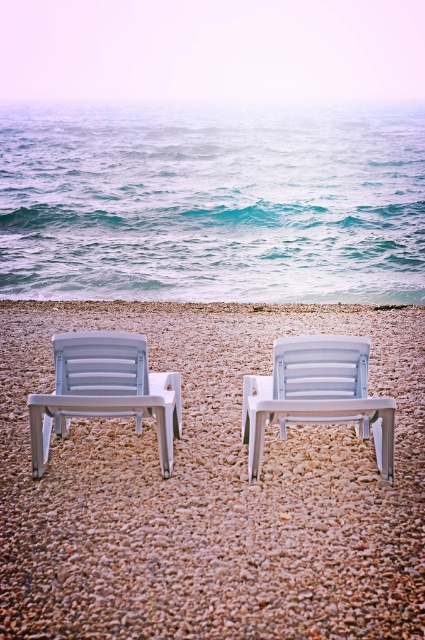
Question: Is the position of white pebbles at center more distant than that of white plastic beach chair at left?

Choices:
 (A) no
 (B) yes

Answer: (A)

Question: Which point is farther from the camera taking this photo?

Choices:
 (A) (229, 563)
 (B) (147, 362)
 (C) (365, 291)
 (D) (356, 428)

Answer: (C)

Question: Estimate the real-world distances between objects in this image. Which object is closer to the blue water at upper center?

Choices:
 (A) white plastic beach chair at left
 (B) white plastic beach chair at center
 (C) white pebbles at center

Answer: (B)

Question: Among these objects, which one is farthest from the camera?

Choices:
 (A) white pebbles at center
 (B) white plastic beach chair at left
 (C) blue water at upper center
 (D) white plastic beach chair at center

Answer: (C)

Question: Does white plastic beach chair at center have a greater width compared to white plastic beach chair at left?

Choices:
 (A) no
 (B) yes

Answer: (A)

Question: Can you confirm if white pebbles at center is positioned below blue water at upper center?

Choices:
 (A) yes
 (B) no

Answer: (A)